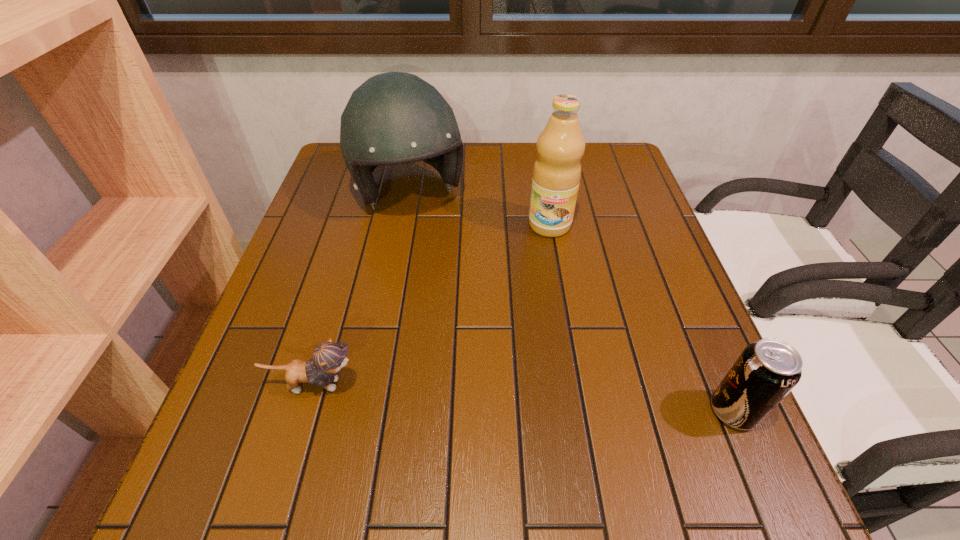
Image resolution: width=960 pixels, height=540 pixels. Identify the location of blank space that satisfies the following two spatial constraints: 1. on the front side of the football helmet; 2. on the left side of the olive oil. (404, 225).